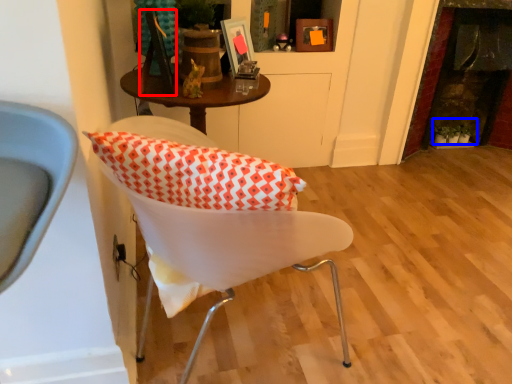
Question: Which object appears closest to the camera in this image, picture frame (highlighted by a red box) or plant (highlighted by a blue box)?

Choices:
 (A) picture frame
 (B) plant

Answer: (A)